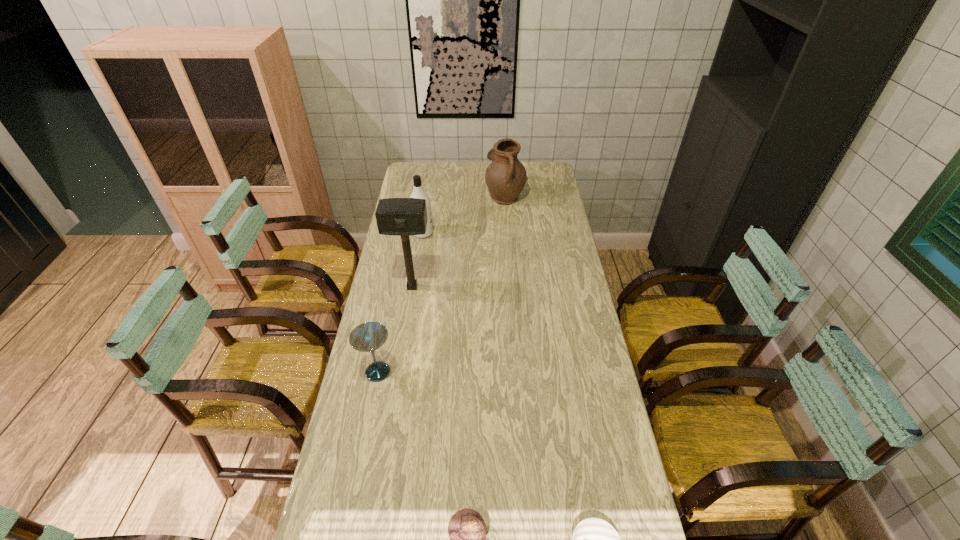
The height and width of the screenshot is (540, 960). I want to click on free area in between the second farthest object and the third nearest object, so click(x=400, y=302).

This screenshot has width=960, height=540. I want to click on empty space between the fifth nearest object and the fourth tallest object, so click(x=400, y=302).

You are a GUI agent. You are given a task and a screenshot of the screen. Output one action in this format:
    pyautogui.click(x=<x>, y=<y>)
    Task: Click on the free space between the mallet and the third shortest object
    Image resolution: width=960 pixels, height=540 pixels.
    Given the screenshot: What is the action you would take?
    pyautogui.click(x=395, y=329)

In order to click on vacant space that's between the pitcher and the fourth nearest object in this screenshot , I will do `click(459, 241)`.

You are a GUI agent. You are given a task and a screenshot of the screen. Output one action in this format:
    pyautogui.click(x=<x>, y=<y>)
    Task: Click on the free point between the mallet and the fourth tallest object
    This screenshot has height=540, width=960.
    Given the screenshot: What is the action you would take?
    pyautogui.click(x=395, y=329)

Where is `object that is the second closest one to the muffin`? object that is the second closest one to the muffin is located at coordinates (367, 337).

Identify which object is the fifth nearest to the shortest object. Please provide its 2D coordinates. Your answer should be formatted as a tuple, i.e. [(x, y)], where the tuple contains the x and y coordinates of a point satisfying the conditions above.

[(505, 177)]